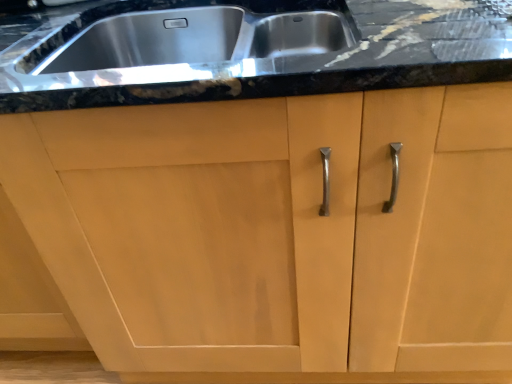
In order to face black granite countertop at center, should I rotate leftwards or rightwards?

A 7.170 degree turn to the left will do.

At what (x,y) coordinates should I click in order to perform the action: click on black granite countertop at center. Please return your answer as a coordinate pair (x, y). The width and height of the screenshot is (512, 384). Looking at the image, I should click on (251, 51).

The height and width of the screenshot is (384, 512). Describe the element at coordinates (251, 51) in the screenshot. I see `black granite countertop at center` at that location.

At what (x,y) coordinates should I click in order to perform the action: click on black granite countertop at center. Please return your answer as a coordinate pair (x, y). Image resolution: width=512 pixels, height=384 pixels. Looking at the image, I should click on (251, 51).